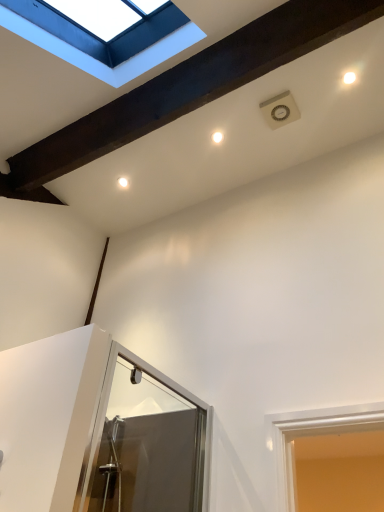
Question: Should I look upward or downward to see white glossy droplight at upper center?

Choices:
 (A) up
 (B) down

Answer: (A)

Question: From a real-world perspective, is white painted wood window at upper left over white glossy droplight at upper center?

Choices:
 (A) no
 (B) yes

Answer: (A)

Question: Can you confirm if white painted wood window at upper left is positioned to the right of white glossy droplight at upper center?

Choices:
 (A) yes
 (B) no

Answer: (B)

Question: From a real-world perspective, does white painted wood window at upper left sit lower than white glossy droplight at upper center?

Choices:
 (A) no
 (B) yes

Answer: (B)

Question: Is white painted wood window at upper left outside white glossy droplight at upper center?

Choices:
 (A) yes
 (B) no

Answer: (A)

Question: Is white painted wood window at upper left positioned with its back to white glossy droplight at upper center?

Choices:
 (A) yes
 (B) no

Answer: (B)

Question: From the image's perspective, would you say white painted wood window at upper left is shown under white glossy droplight at upper center?

Choices:
 (A) yes
 (B) no

Answer: (B)

Question: Does white glossy droplight at upper center have a greater height compared to white painted wood window at upper left?

Choices:
 (A) yes
 (B) no

Answer: (B)

Question: Does white glossy droplight at upper center lie in front of white painted wood window at upper left?

Choices:
 (A) no
 (B) yes

Answer: (A)

Question: Is white glossy droplight at upper center directly adjacent to white painted wood window at upper left?

Choices:
 (A) yes
 (B) no

Answer: (B)

Question: Is white glossy droplight at upper center facing away from white painted wood window at upper left?

Choices:
 (A) yes
 (B) no

Answer: (B)

Question: Does white glossy droplight at upper center have a larger size compared to white painted wood window at upper left?

Choices:
 (A) no
 (B) yes

Answer: (A)

Question: Is white glossy droplight at upper center oriented towards white painted wood window at upper left?

Choices:
 (A) no
 (B) yes

Answer: (B)

Question: In terms of width, does white painted wood window at upper left look wider or thinner when compared to white glossy droplight at upper center?

Choices:
 (A) thin
 (B) wide

Answer: (B)